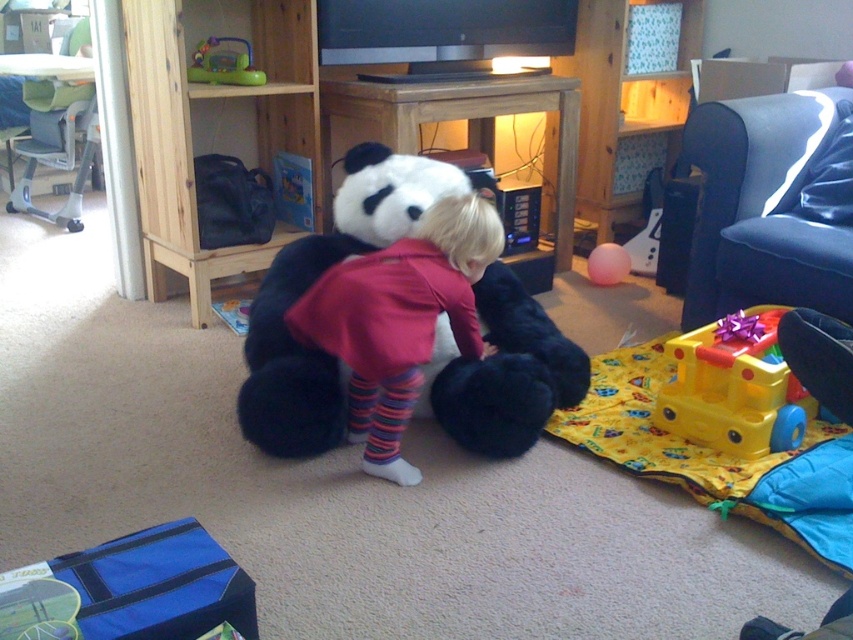
Question: Which point is closer to the camera taking this photo?

Choices:
 (A) (554, 188)
 (B) (596, 246)
 (C) (756, 374)

Answer: (C)

Question: Is yellow plastic train at lower right positioned behind green plastic toy at upper left?

Choices:
 (A) yes
 (B) no

Answer: (B)

Question: Is the position of wooden entertainment center at center less distant than that of soft plush panda at center?

Choices:
 (A) yes
 (B) no

Answer: (B)

Question: Which point is closer to the camera?

Choices:
 (A) (463, 353)
 (B) (611, 246)
 (C) (213, 65)

Answer: (A)

Question: Estimate the real-world distances between objects in this image. Which object is closer to the green plastic toy at upper left?

Choices:
 (A) wooden entertainment center at center
 (B) yellow plastic train at lower right
 (C) rubber ball at center

Answer: (A)

Question: Observing the image, what is the correct spatial positioning of wooden entertainment center at center in reference to soft plush panda at center?

Choices:
 (A) left
 (B) right

Answer: (A)